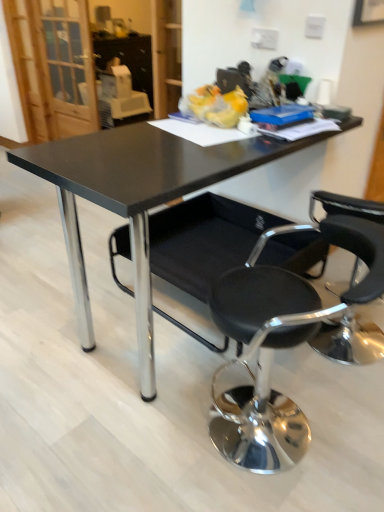
Question: Which direction should I rotate to look at black fabric chair at center, which is counted as the 1th chair, starting from the back?

Choices:
 (A) left
 (B) right

Answer: (B)

Question: Can black glossy table at center be found inside black leather chair at lower right, which is counted as the 2th chair, starting from the back?

Choices:
 (A) no
 (B) yes

Answer: (A)

Question: Can you confirm if black leather chair at lower right, which is the first chair from front to back, is taller than black glossy table at center?

Choices:
 (A) no
 (B) yes

Answer: (A)

Question: Is black leather chair at lower right, which is counted as the 2th chair, starting from the back, not near black glossy table at center?

Choices:
 (A) no
 (B) yes

Answer: (A)

Question: Is the depth of black leather chair at lower right, which is counted as the 2th chair, starting from the back, greater than that of black glossy table at center?

Choices:
 (A) no
 (B) yes

Answer: (A)

Question: Can we say black leather chair at lower right, which is the first chair from front to back, lies outside black glossy table at center?

Choices:
 (A) yes
 (B) no

Answer: (A)

Question: Can you confirm if black leather chair at lower right, which is counted as the 2th chair, starting from the back, is wider than black glossy table at center?

Choices:
 (A) no
 (B) yes

Answer: (A)

Question: Is black fabric chair at center, the second chair viewed from the front, closer to the viewer compared to black glossy table at center?

Choices:
 (A) yes
 (B) no

Answer: (B)

Question: Considering the relative sizes of black fabric chair at center, which is counted as the 1th chair, starting from the back, and black glossy table at center in the image provided, is black fabric chair at center, which is counted as the 1th chair, starting from the back, taller than black glossy table at center?

Choices:
 (A) yes
 (B) no

Answer: (B)

Question: Is black fabric chair at center, which is counted as the 1th chair, starting from the back, facing towards black glossy table at center?

Choices:
 (A) no
 (B) yes

Answer: (B)

Question: From a real-world perspective, is black fabric chair at center, which is counted as the 1th chair, starting from the back, positioned over black glossy table at center based on gravity?

Choices:
 (A) yes
 (B) no

Answer: (B)

Question: Are black fabric chair at center, which is counted as the 1th chair, starting from the back, and black glossy table at center beside each other?

Choices:
 (A) no
 (B) yes

Answer: (A)

Question: From a real-world perspective, is black fabric chair at center, the second chair viewed from the front, located beneath black glossy table at center?

Choices:
 (A) yes
 (B) no

Answer: (A)

Question: Does black glossy table at center come in front of black fabric chair at center, which is counted as the 1th chair, starting from the back?

Choices:
 (A) no
 (B) yes

Answer: (B)